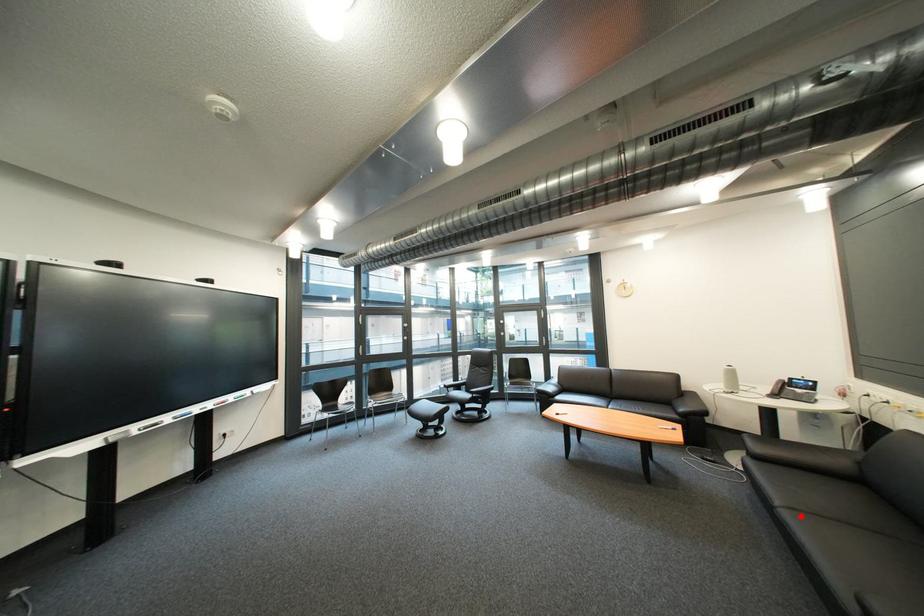
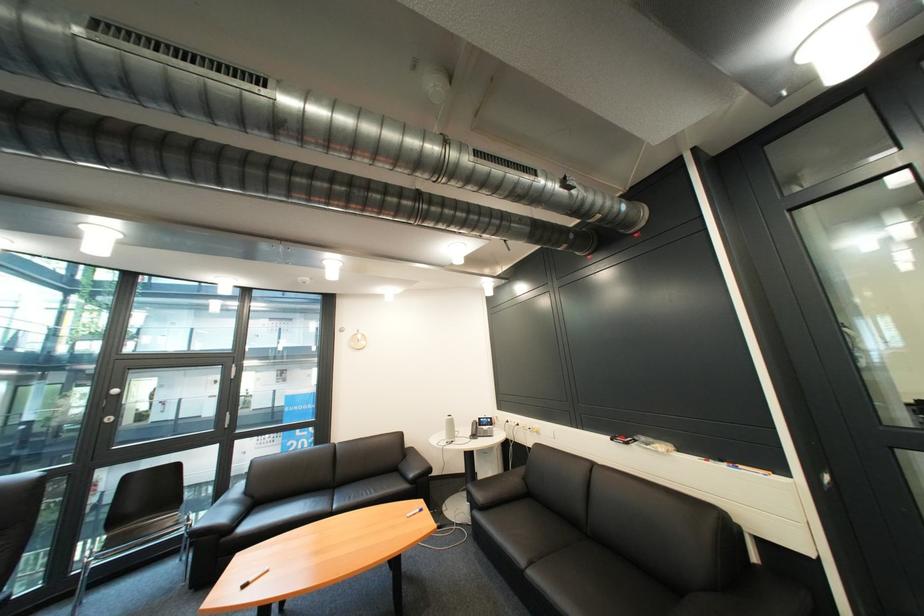
In the second image, find the point that corresponds to the highlighted location in the first image.

(546, 577)